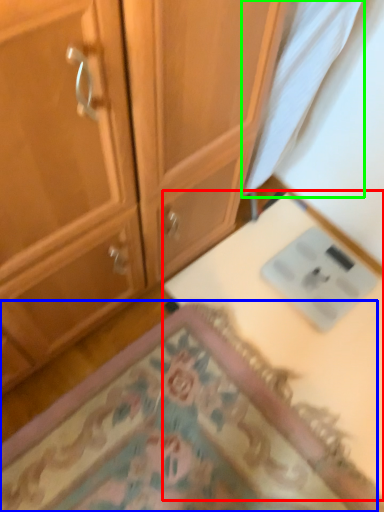
Question: Which object is positioned closest to table (highlighted by a red box)? Select from mat (highlighted by a blue box) and fabric (highlighted by a green box).

Choices:
 (A) mat
 (B) fabric

Answer: (A)